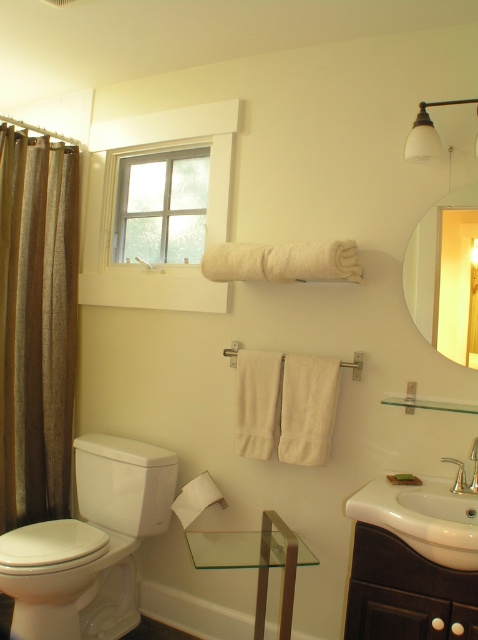
Question: Which of these objects is positioned farthest from the transparent glass table at center?

Choices:
 (A) matte glass mirror at upper right
 (B) polished chrome faucet at sink right
 (C) white glossy toilet bowl at lower left
 (D) brown textured shower curtain at left

Answer: (D)

Question: Estimate the real-world distances between objects in this image. Which object is farther from the brown textured shower curtain at left?

Choices:
 (A) polished chrome faucet at sink right
 (B) white glossy toilet bowl at lower left
 (C) transparent glass table at center

Answer: (A)

Question: Is brown textured shower curtain at left positioned in front of matte glass mirror at upper right?

Choices:
 (A) no
 (B) yes

Answer: (A)

Question: Does brown textured shower curtain at left appear under white glossy toilet bowl at lower left?

Choices:
 (A) yes
 (B) no

Answer: (B)

Question: Estimate the real-world distances between objects in this image. Which object is closer to the white glossy sink at lower right?

Choices:
 (A) brown textured shower curtain at left
 (B) white glossy toilet bowl at lower left

Answer: (B)

Question: Does white glossy sink at lower right come in front of transparent glass table at center?

Choices:
 (A) yes
 (B) no

Answer: (A)